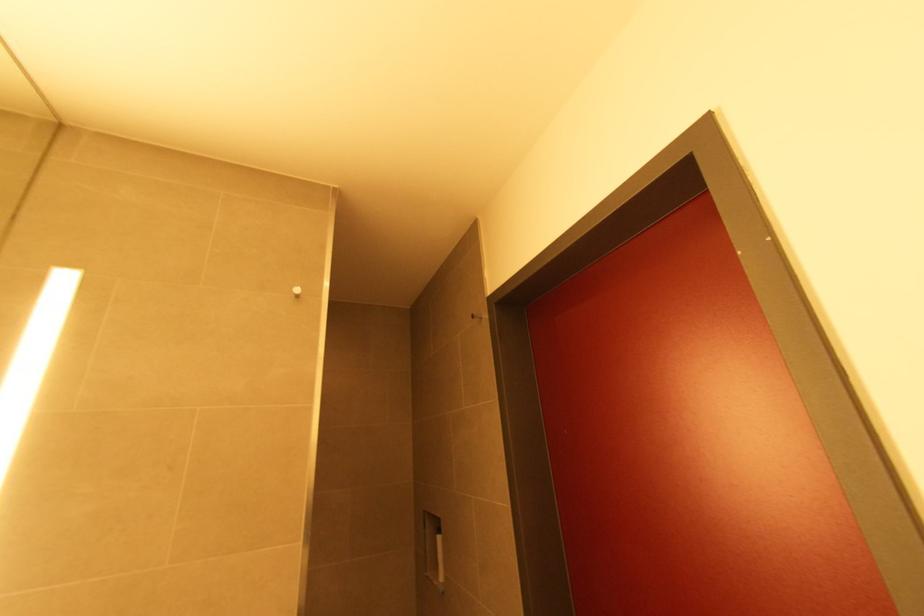
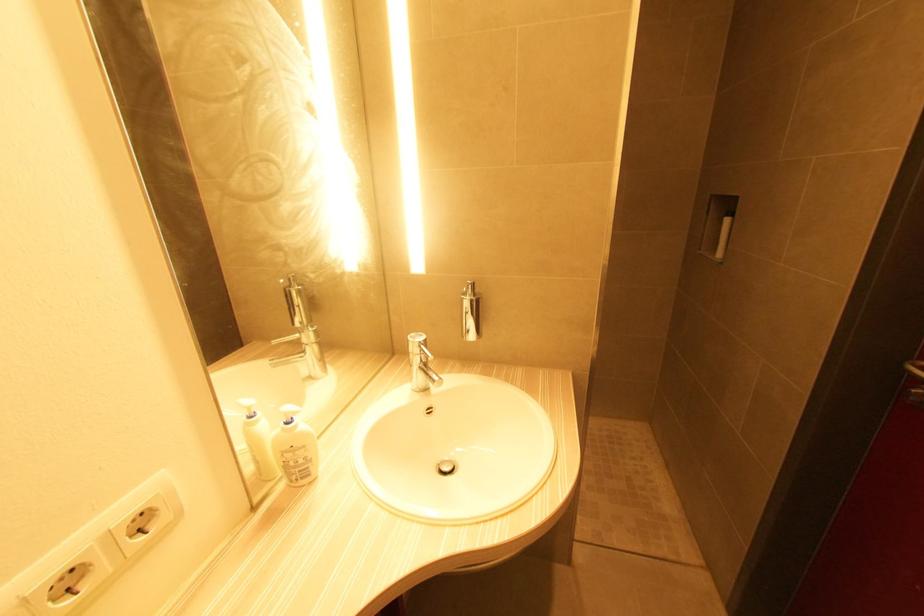
The images are taken continuously from a first-person perspective. In which direction is your viewpoint rotating?

The rotation direction of the camera is left-down.